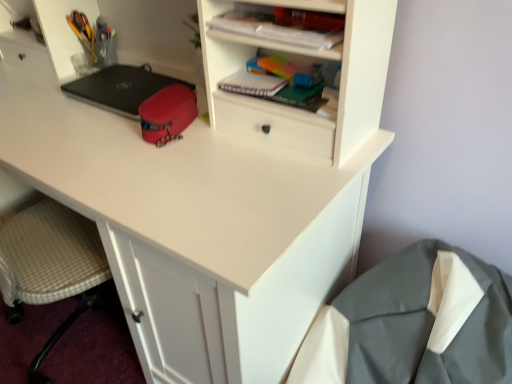
Question: Is matte plastic notebook at upper center far away from metallic pen holder at upper left, positioned as the 2th stationery in right-to-left order?

Choices:
 (A) yes
 (B) no

Answer: (B)

Question: Are matte plastic notebook at upper center and metallic pen holder at upper left, positioned as the 2th stationery in right-to-left order, making contact?

Choices:
 (A) no
 (B) yes

Answer: (A)

Question: Does matte plastic notebook at upper center turn towards metallic pen holder at upper left, placed as the first stationery when sorted from left to right?

Choices:
 (A) yes
 (B) no

Answer: (B)

Question: Can you confirm if matte plastic notebook at upper center is smaller than metallic pen holder at upper left, positioned as the 2th stationery in right-to-left order?

Choices:
 (A) yes
 (B) no

Answer: (A)

Question: Can you confirm if matte plastic notebook at upper center is positioned to the right of metallic pen holder at upper left, the second stationery viewed from the front?

Choices:
 (A) yes
 (B) no

Answer: (A)

Question: In the image, is matte plastic notebook at upper center on the left side or the right side of gray fabric sleeping bag at lower right?

Choices:
 (A) left
 (B) right

Answer: (A)

Question: Looking at the image, does matte plastic notebook at upper center seem bigger or smaller compared to gray fabric sleeping bag at lower right?

Choices:
 (A) small
 (B) big

Answer: (A)

Question: Considering their positions, is matte plastic notebook at upper center located in front of or behind gray fabric sleeping bag at lower right?

Choices:
 (A) behind
 (B) front

Answer: (A)

Question: From the image's perspective, is matte plastic notebook at upper center positioned above or below gray fabric sleeping bag at lower right?

Choices:
 (A) above
 (B) below

Answer: (A)

Question: Is matte red pouch at center, the 2th stationery in the left-to-right sequence, inside the boundaries of black matte laptop at center, or outside?

Choices:
 (A) inside
 (B) outside

Answer: (B)

Question: Considering their positions, is matte red pouch at center, which appears as the 1th stationery when viewed from the front, located in front of or behind black matte laptop at center?

Choices:
 (A) front
 (B) behind

Answer: (A)

Question: In terms of width, does matte red pouch at center, the 2th stationery in the left-to-right sequence, look wider or thinner when compared to black matte laptop at center?

Choices:
 (A) thin
 (B) wide

Answer: (A)

Question: Looking at the image, does matte red pouch at center, arranged as the first stationery when viewed from the right, seem bigger or smaller compared to black matte laptop at center?

Choices:
 (A) small
 (B) big

Answer: (A)

Question: Is plaid paper notebook at upper center wider or thinner than gray fabric sleeping bag at lower right?

Choices:
 (A) thin
 (B) wide

Answer: (A)

Question: From the image's perspective, is plaid paper notebook at upper center located above or below gray fabric sleeping bag at lower right?

Choices:
 (A) below
 (B) above

Answer: (B)